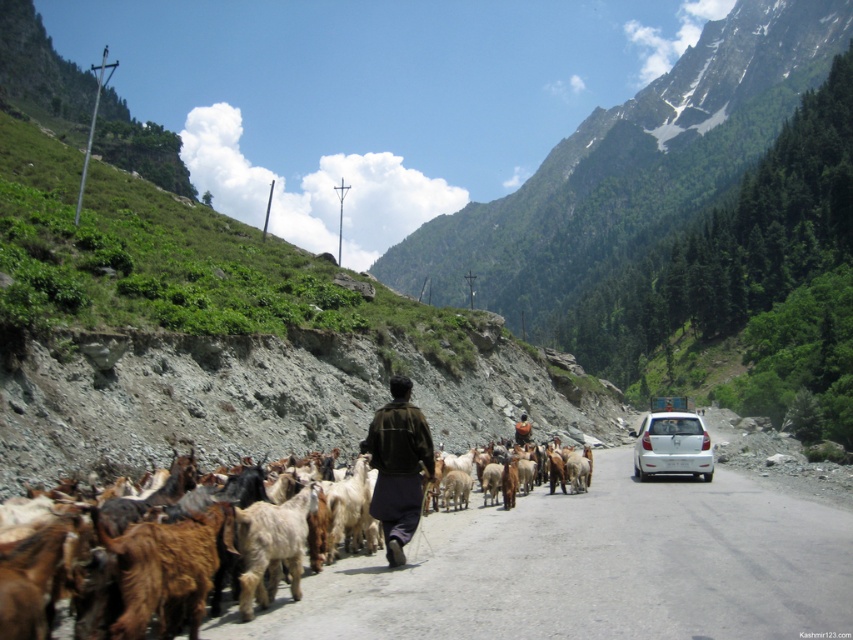
Question: Among these points, which one is nearest to the camera?

Choices:
 (A) (515, 436)
 (B) (235, 531)
 (C) (762, 625)

Answer: (C)

Question: Which point is farther to the camera?

Choices:
 (A) brown woolen sweater at center
 (B) brown woolen goats at center
 (C) white matte car at center

Answer: (A)

Question: Does brown woolen goats at center have a lesser width compared to shaggy beige goat at center?

Choices:
 (A) no
 (B) yes

Answer: (A)

Question: Does dark brown fabric at center appear under white matte car at center?

Choices:
 (A) yes
 (B) no

Answer: (B)

Question: Which object is positioned closest to the shaggy beige goat at center?

Choices:
 (A) white matte car at center
 (B) dark brown fabric at center
 (C) brown woolen goats at center

Answer: (B)

Question: Does shaggy beige goat at center lie behind white matte car at center?

Choices:
 (A) yes
 (B) no

Answer: (B)